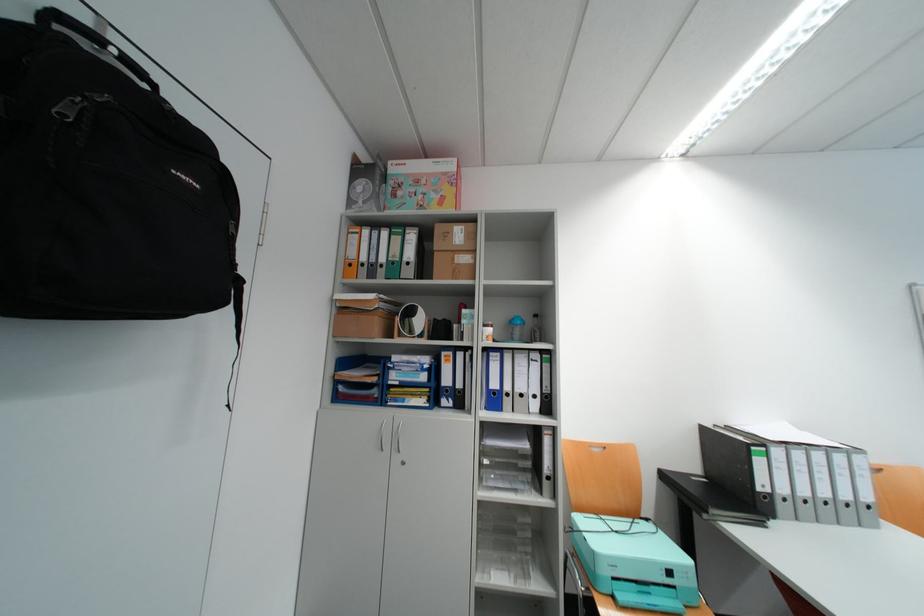
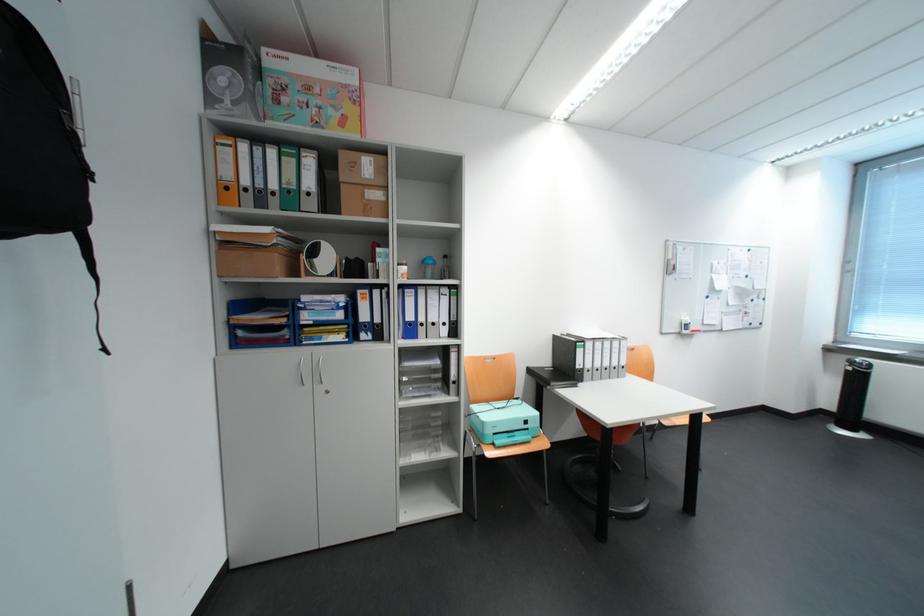
In the second image, find the point that corresponds to pixel 459 236 in the first image.

(368, 167)